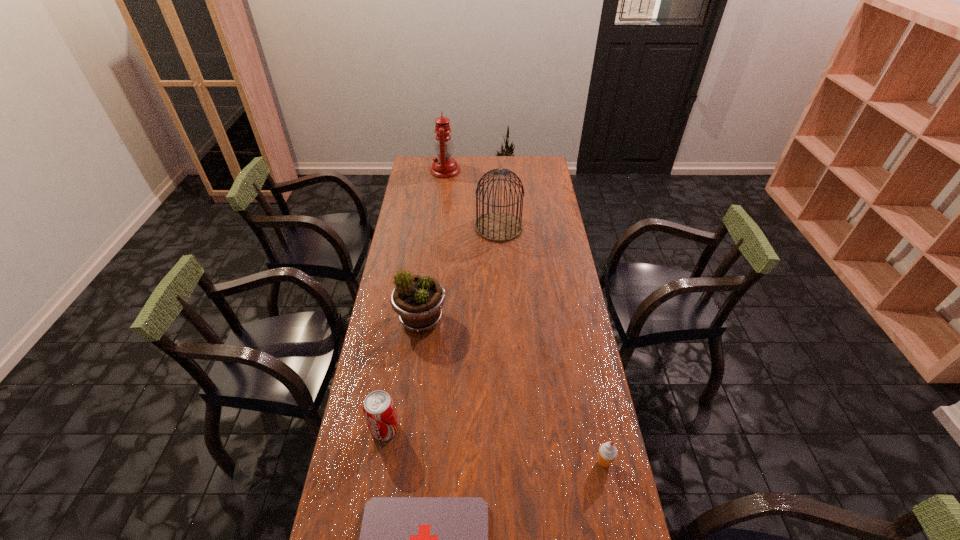
At what (x,y) coordinates should I click in order to perform the action: click on vacant area in the image that satisfies the following two spatial constraints: 1. on the front side of the fifth tallest object; 2. on the left side of the third farthest object. Please return your answer as a coordinate pair (x, y). This screenshot has height=540, width=960. Looking at the image, I should click on (403, 462).